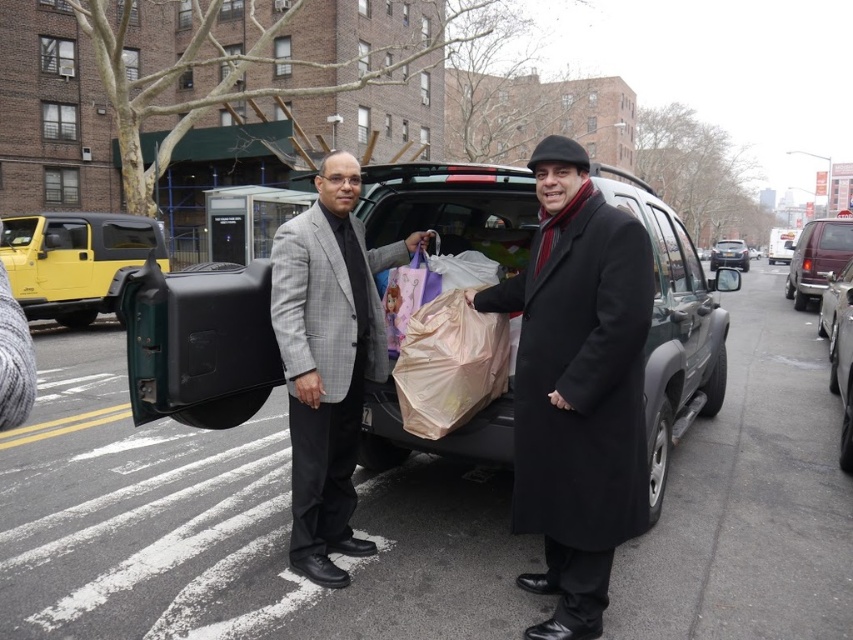
Does point (502, 396) lie behind point (566, 419)?

Yes, it is behind point (566, 419).

Does black matte car at center have a larger size compared to black wool coat at center?

Actually, black matte car at center might be smaller than black wool coat at center.

Image resolution: width=853 pixels, height=640 pixels. I want to click on black matte car at center, so click(199, 342).

Based on the photo, can you confirm if black matte car at center is positioned to the left of maroon metallic van at right?

Yes, black matte car at center is to the left of maroon metallic van at right.

Is point (213, 419) farther from viewer compared to point (793, 250)?

That is False.

In order to click on black matte car at center in this screenshot , I will do `click(199, 342)`.

From the picture: Does yellow matte jeep at left have a larger size compared to maroon metallic van at right?

Actually, yellow matte jeep at left might be smaller than maroon metallic van at right.

How distant is yellow matte jeep at left from maroon metallic van at right?

yellow matte jeep at left and maroon metallic van at right are 16.60 meters apart from each other.

The height and width of the screenshot is (640, 853). What do you see at coordinates (74, 260) in the screenshot?
I see `yellow matte jeep at left` at bounding box center [74, 260].

Find the location of `yellow matte jeep at left`. yellow matte jeep at left is located at coordinates (74, 260).